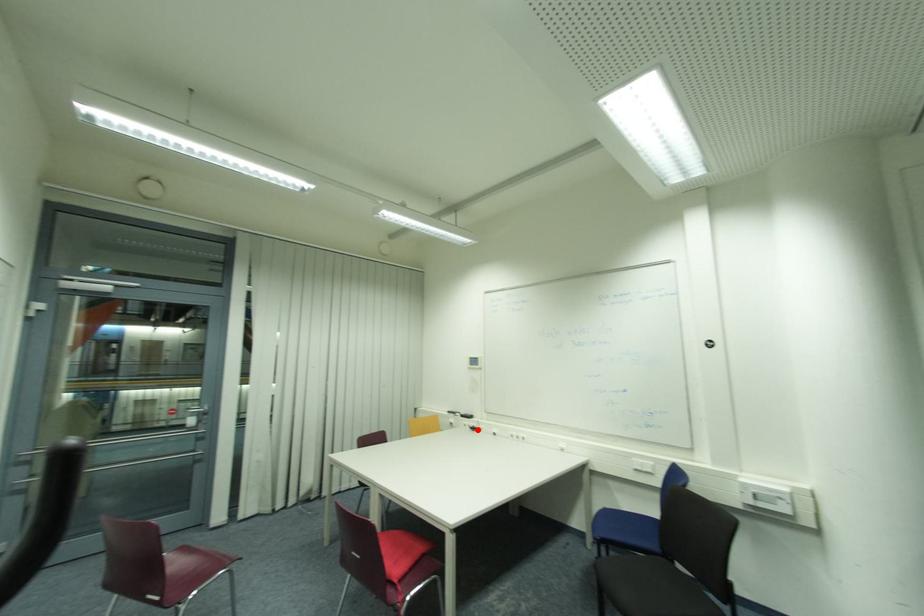
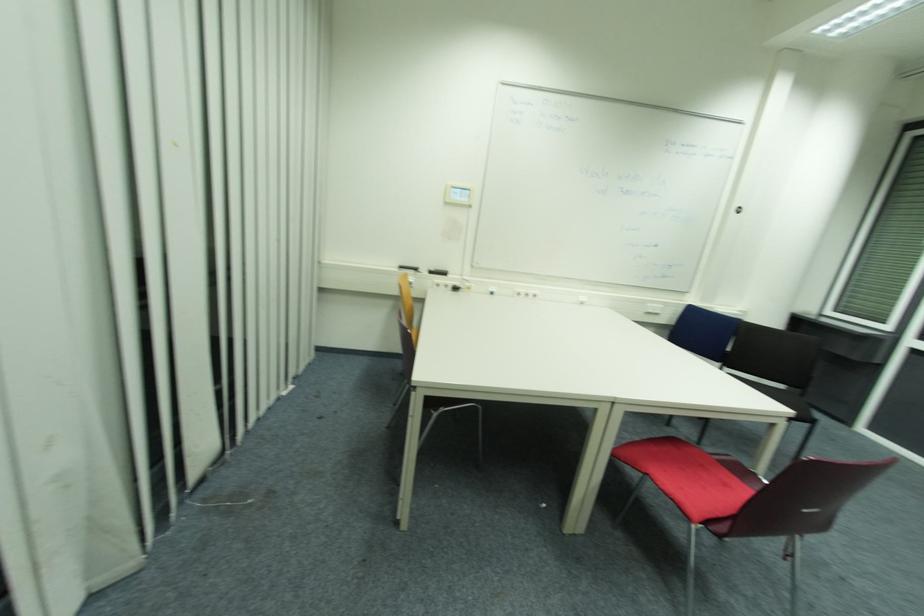
In the second image, find the point that corresponds to the highlighted location in the first image.

(458, 290)